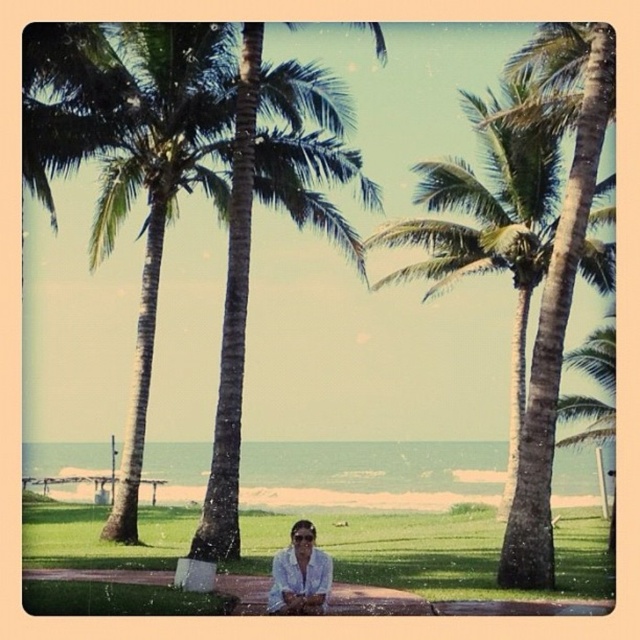
Can you confirm if green leafy palm tree at right is positioned to the left of white matte shirt at lower center?

In fact, green leafy palm tree at right is to the right of white matte shirt at lower center.

Who is more forward, (538, 237) or (289, 609)?

Point (289, 609) is in front.

You are a GUI agent. You are given a task and a screenshot of the screen. Output one action in this format:
    pyautogui.click(x=<x>, y=<y>)
    Task: Click on the green leafy palm tree at right
    Image resolution: width=640 pixels, height=640 pixels.
    Given the screenshot: What is the action you would take?
    pyautogui.click(x=490, y=227)

Which is below, green leafy palm tree at right or green leafy palm tree at center?

Positioned lower is green leafy palm tree at right.

Who is more forward, (524, 321) or (232, 497)?

Point (232, 497) is more forward.

Find the location of a particular element. The image size is (640, 640). green leafy palm tree at right is located at coordinates (490, 227).

Which of these two, green leafy palm tree at center or white matte shirt at lower center, stands taller?

green leafy palm tree at center is taller.

Can you confirm if green leafy palm tree at center is wider than white matte shirt at lower center?

Yes.

Which is in front, point (230, 237) or point (308, 568)?

Positioned in front is point (308, 568).

Locate an element on the screen. Image resolution: width=640 pixels, height=640 pixels. green leafy palm tree at center is located at coordinates (232, 320).